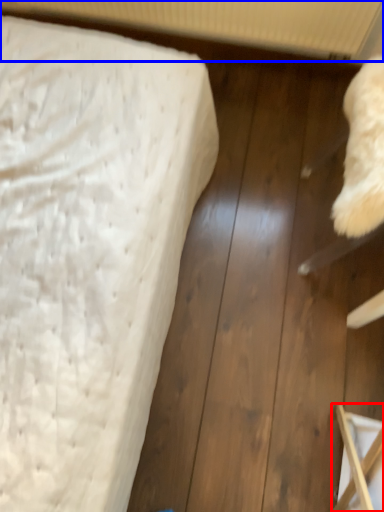
Question: Which of the following is the closest to the observer, furniture (highlighted by a red box) or radiator (highlighted by a blue box)?

Choices:
 (A) furniture
 (B) radiator

Answer: (A)